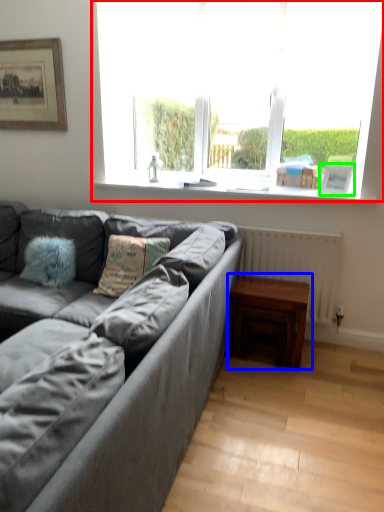
Question: Which is nearer to the window (highlighted by a red box)? table (highlighted by a blue box) or picture frame (highlighted by a green box).

Choices:
 (A) table
 (B) picture frame

Answer: (B)